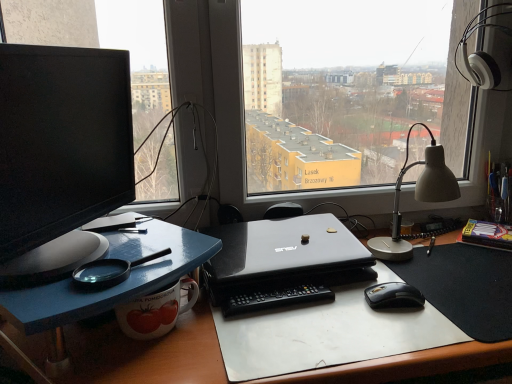
Question: In the image, is white plastic notepad at right on the left side or the right side of white plastic table lamp at right?

Choices:
 (A) left
 (B) right

Answer: (B)

Question: Looking at their shapes, would you say white plastic notepad at right is wider or thinner than white plastic table lamp at right?

Choices:
 (A) wide
 (B) thin

Answer: (B)

Question: Considering the real-world distances, which object is farthest from the white plastic table lamp at right?

Choices:
 (A) black plastic remote control at center
 (B) black matte laptop at center
 (C) white glossy desk at center
 (D) white plastic notepad at right
 (E) black rubber mousepad at lower right

Answer: (C)

Question: Which object is positioned farthest from the white plastic notepad at right?

Choices:
 (A) black plastic remote control at center
 (B) matte black monitor at left
 (C) white glossy desk at center
 (D) black glossy mouse at lower right
 (E) black rubber mousepad at lower right

Answer: (B)